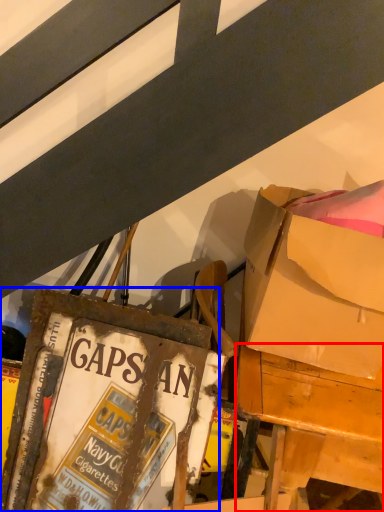
Question: Which of the following is the closest to the observer, desk (highlighted by a red box) or paperback book (highlighted by a blue box)?

Choices:
 (A) desk
 (B) paperback book

Answer: (A)